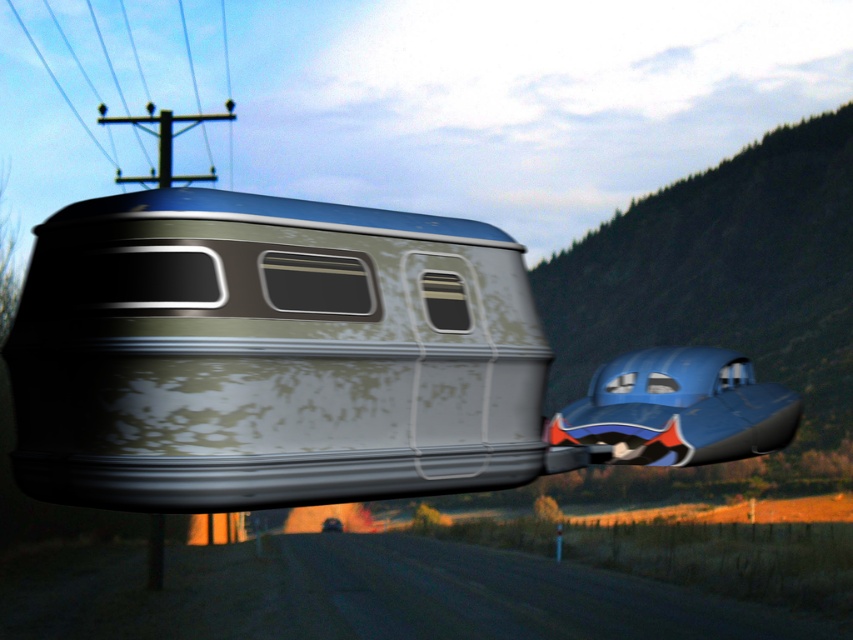
Who is more forward, (729, 440) or (15, 13)?

Point (729, 440) is more forward.

Does point (628, 365) come farther from viewer compared to point (169, 112)?

No, (628, 365) is closer to viewer.

Locate an element on the screen. blue rubber car at center right is located at coordinates (677, 410).

Identify the location of blue rubber car at center right. (677, 410).

Is the position of rusty metal train car at center more distant than that of blue rubber car at center right?

No.

Describe the element at coordinates (270, 355) in the screenshot. I see `rusty metal train car at center` at that location.

This screenshot has height=640, width=853. What are the coordinates of `rusty metal train car at center` in the screenshot? It's located at (270, 355).

Which is behind, point (215, 484) or point (210, 168)?

Point (210, 168)

Based on the photo, between rusty metal train car at center and metallic wire at upper left, which one appears on the right side from the viewer's perspective?

Positioned to the right is rusty metal train car at center.

Where is `rusty metal train car at center`? rusty metal train car at center is located at coordinates (270, 355).

At what (x,y) coordinates should I click in order to perform the action: click on rusty metal train car at center. Please return your answer as a coordinate pair (x, y). The height and width of the screenshot is (640, 853). Looking at the image, I should click on [270, 355].